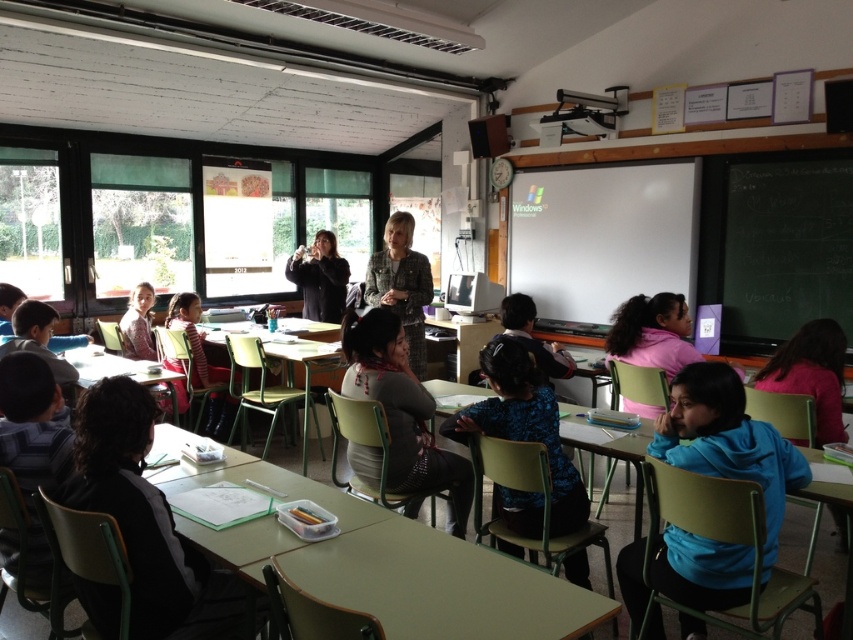
You are a student in the classroom and want to place a small notebook on the green plastic table at lower left. However, there is a dark gray sweater at center in the way. Can you move the sweater to access the table?

The dark gray sweater at center is in front of the green plastic table at lower left, so you can move the sweater to access the table.

From the picture: You are a student sitting at your desk in the classroom. You notice two points marked on the floor. One is at coordinates point (x=659, y=180) and the other is at point (x=80, y=362). If you want to walk from your desk to the point that is further away from the front of the classroom, which point should you go to?

You should go to point (x=659, y=180) because it is behind point (x=80, y=362), meaning it is farther from the front of the classroom.

You are standing at the entrance of the classroom and notice a dark gray sweater at center. If you want to pick it up, which direction should you move towards from your current position?

Since the dark gray sweater at center is located at point 0.642 on the x and 0.472 on the y, you should move towards the center of the room to reach it.